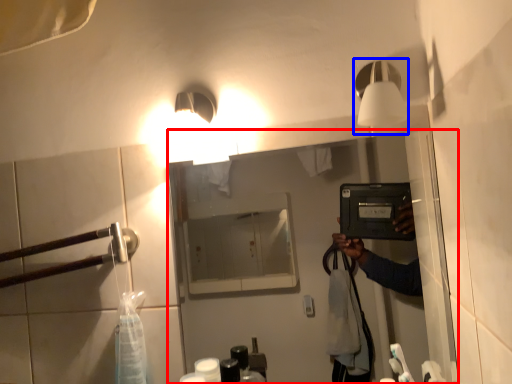
Question: Among these objects, which one is nearest to the camera, mirror (highlighted by a red box) or light fixture (highlighted by a blue box)?

Choices:
 (A) mirror
 (B) light fixture

Answer: (B)